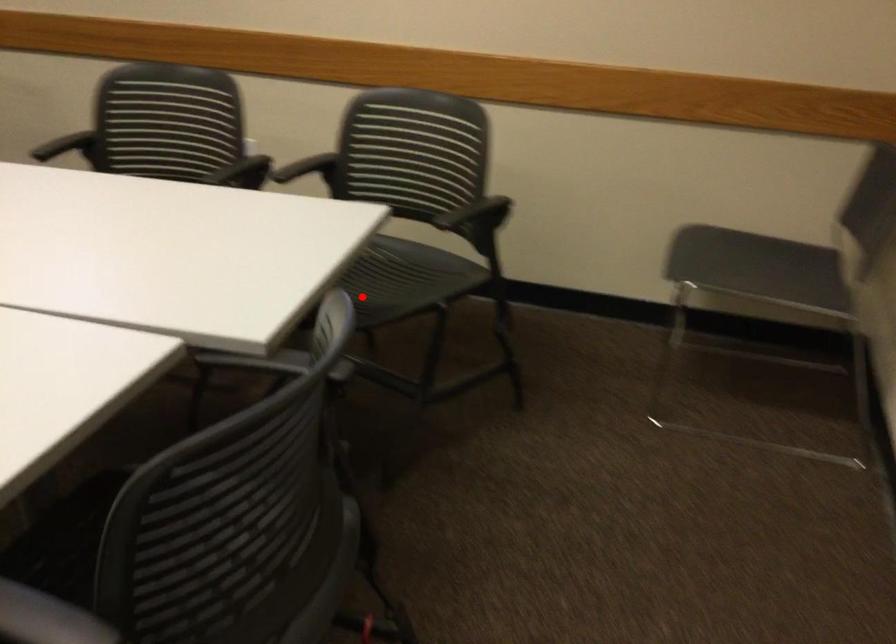
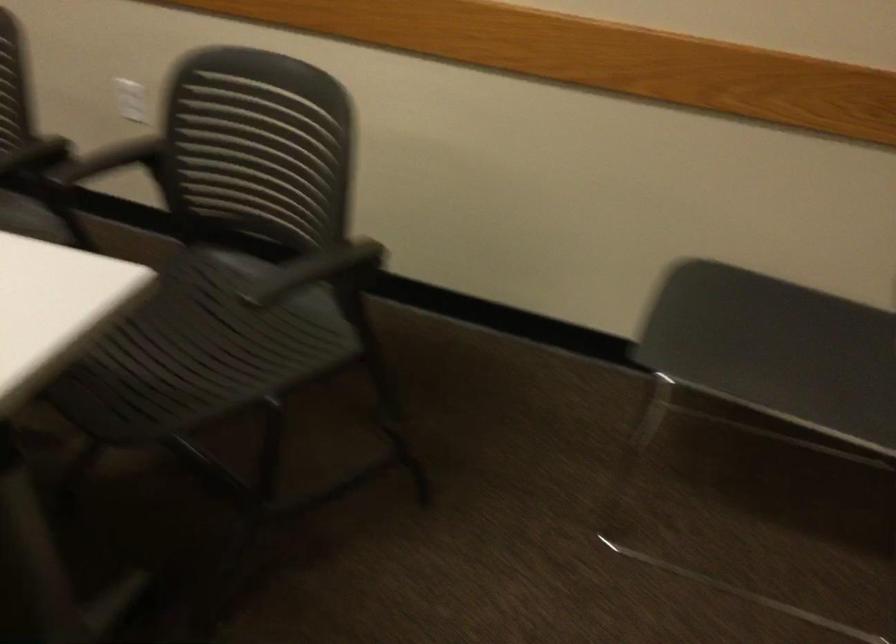
Question: I am providing you with two images of the same scene from different viewpoints. Given a red point in image1, look at the same physical point in image2. Is it:

Choices:
 (A) Closer to the viewpoint
 (B) Farther from the viewpoint

Answer: (A)